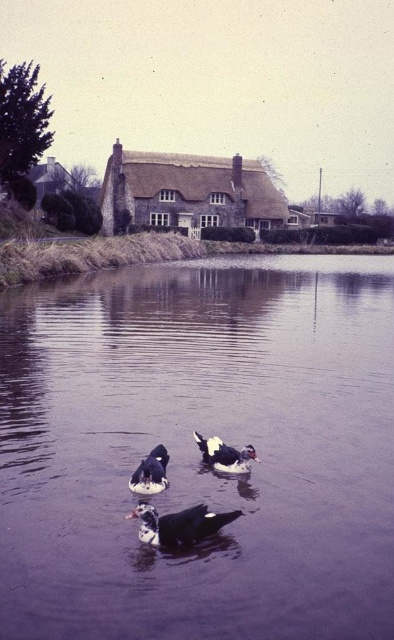
You are standing on the dock and see the black glossy duck at center and the white glossy duck at center. Which duck is nearer to you?

The black glossy duck at center is closer to the viewer than the white glossy duck at center, so the black glossy duck at center is nearer to you.

You are standing at the edge of the water near the cottage and want to throw a stone to hit the point marked at coordinates point (232, 470). Can you reach that point with your throw?

The point marked at coordinates point (232, 470) is 8.88 meters away from the viewer. Since the average throwing distance for a stone is around 15 meters, you should be able to reach it.